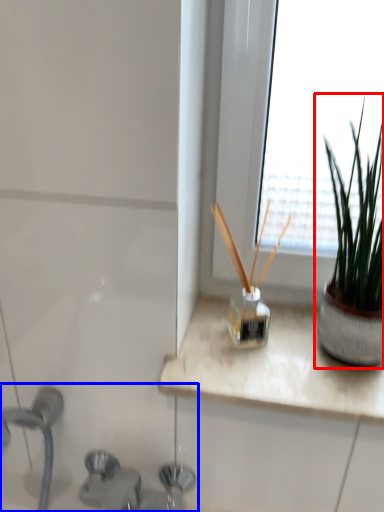
Question: Which object is further to the camera taking this photo, houseplant (highlighted by a red box) or sink (highlighted by a blue box)?

Choices:
 (A) houseplant
 (B) sink

Answer: (A)